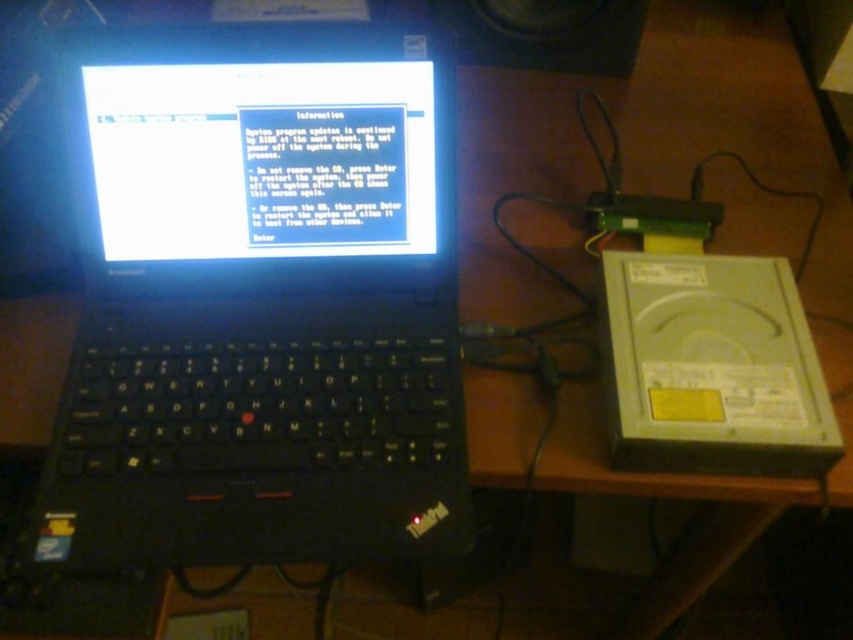
You are trying to locate the black plastic speaker at upper center in the image. Based on the scene, where would you find it relative to the black plastic laptop at center?

The black plastic speaker at upper center is to the right of the black plastic laptop at center.

Looking at this image, you are setting up a home office and need to place a new monitor between the black plastic laptop at center and the black plastic speaker at upper center. Given that the monitor requires 30 cm of space, can you fit it between them?

The black plastic laptop at center is bigger than the black plastic speaker at upper center, but the description does not provide exact measurements of the distance between them. Therefore, it is uncertain if the 30 cm space required for the monitor is available.